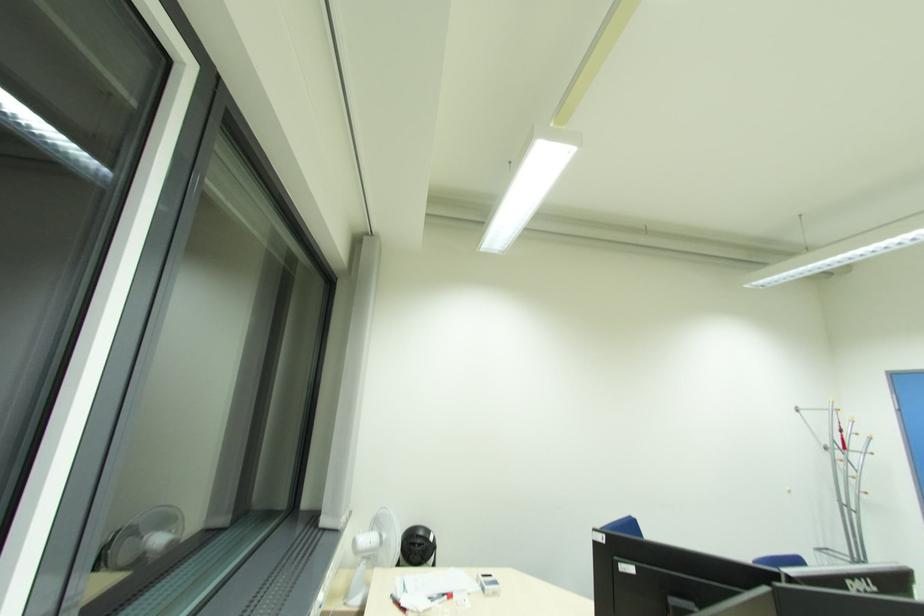
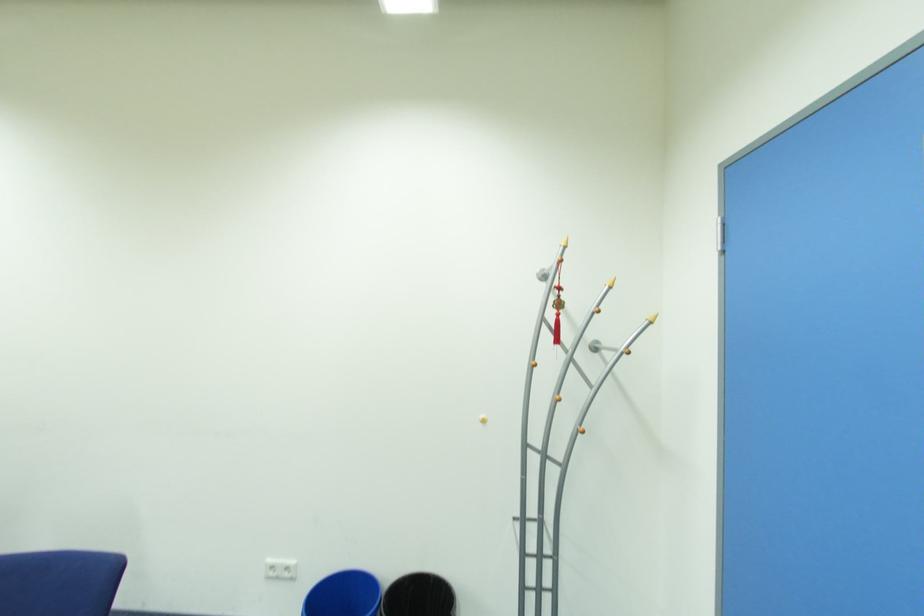
In a continuous first-person perspective shot, in which direction is the camera moving?

The cameraman moved toward right, forward.